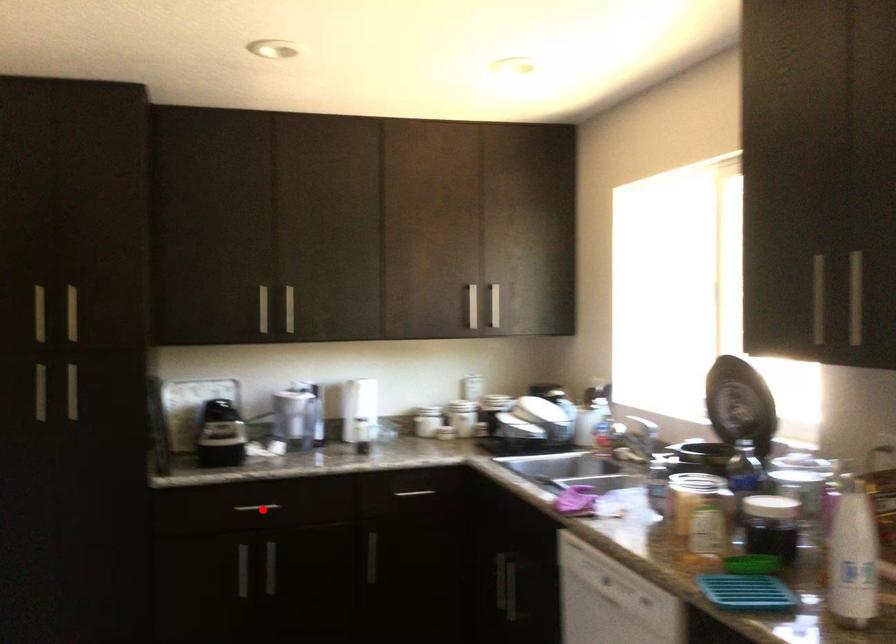
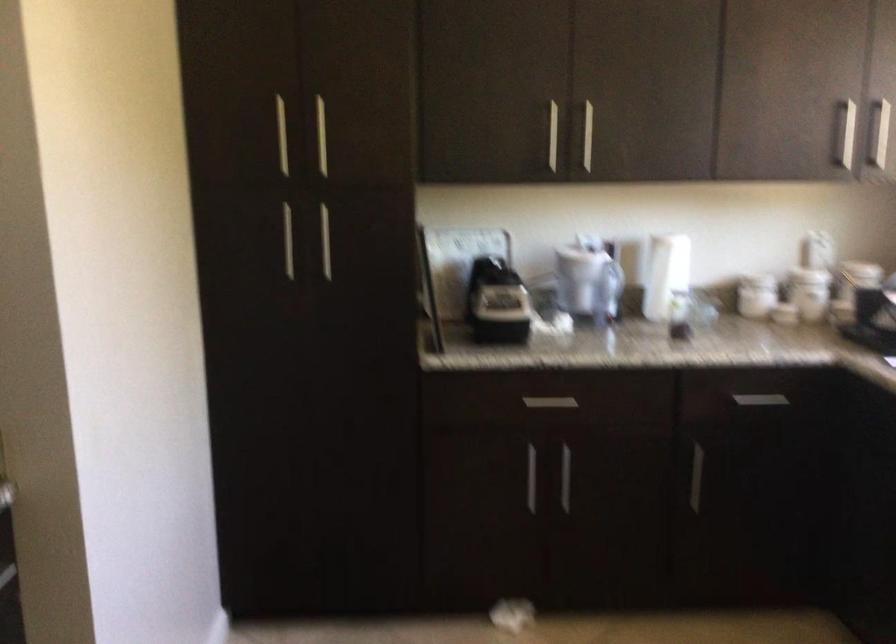
Question: I am providing you with two images of the same scene from different viewpoints. A red point is shown in image1. For the corresponding object point in image2, is it positioned nearer or farther from the camera?

Choices:
 (A) Nearer
 (B) Farther

Answer: (A)